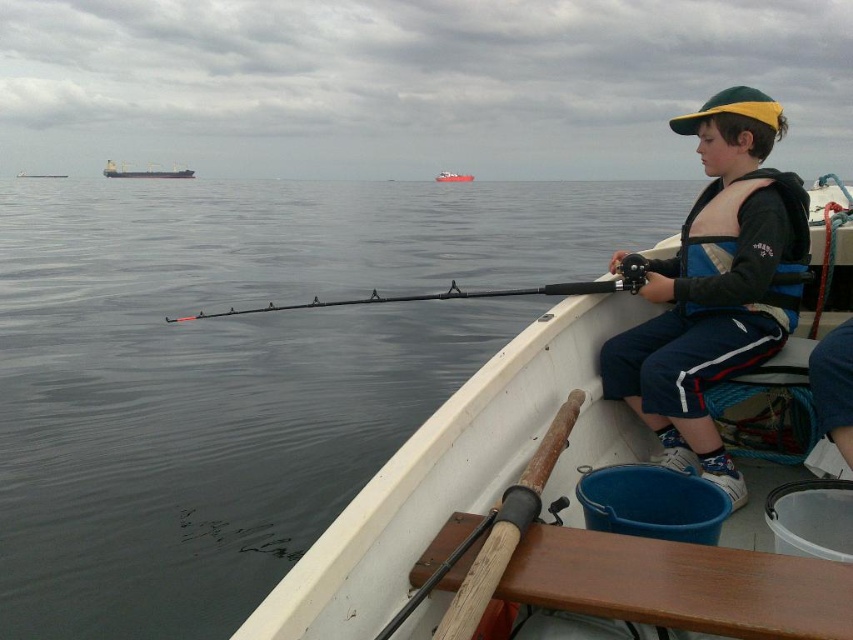
Question: Which of the following is the closest to the observer?

Choices:
 (A) metallic gray cargo ship at upper left
 (B) blue life vest at center
 (C) metallic gray boat at left
 (D) red glossy boat at center

Answer: (B)

Question: Does smooth water at center have a larger size compared to metallic gray boat at left?

Choices:
 (A) yes
 (B) no

Answer: (A)

Question: Can you confirm if smooth water at center is positioned below metallic gray cargo ship at upper left?

Choices:
 (A) no
 (B) yes

Answer: (B)

Question: Which point is farther to the camera?

Choices:
 (A) metallic gray cargo ship at upper left
 (B) smooth water at center
 (C) metallic gray boat at left

Answer: (A)

Question: Is metallic gray cargo ship at upper left positioned behind metallic gray boat at left?

Choices:
 (A) yes
 (B) no

Answer: (A)

Question: Which point appears farthest from the camera in this image?

Choices:
 (A) (51, 177)
 (B) (708, 157)

Answer: (A)